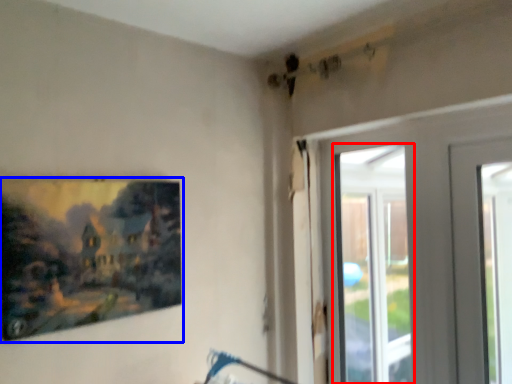
Question: Which of the following is the closest to the observer, window (highlighted by a red box) or picture frame (highlighted by a blue box)?

Choices:
 (A) window
 (B) picture frame

Answer: (B)